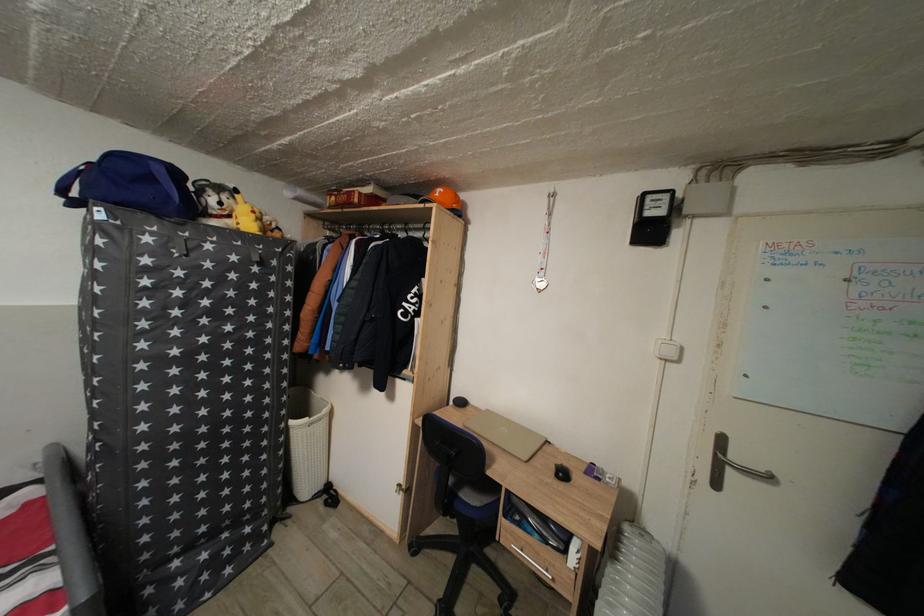
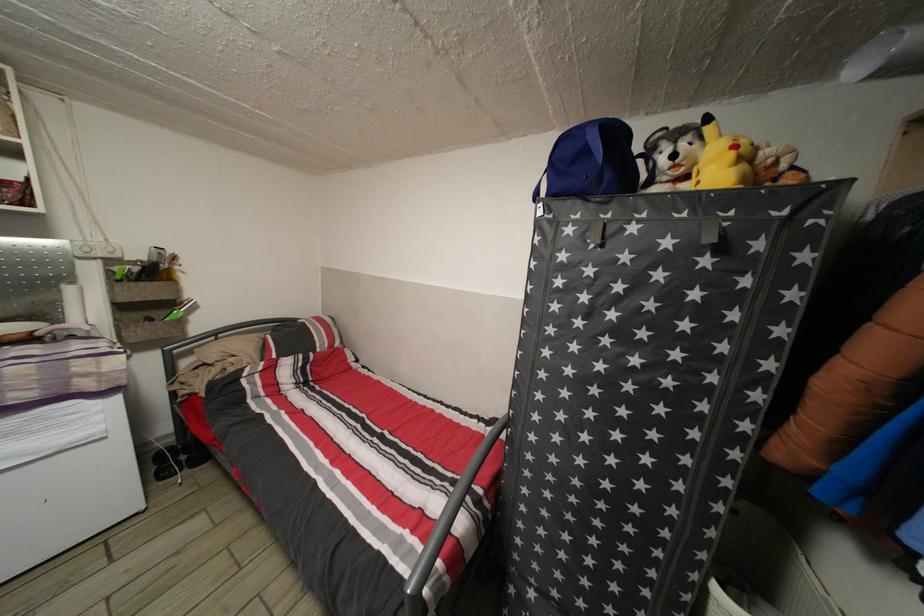
The point at (154, 246) is marked in the first image. Where is the corresponding point in the second image?

(576, 237)